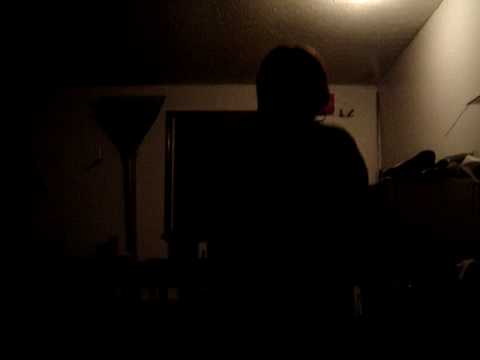
You are a GUI agent. You are given a task and a screenshot of the screen. Output one action in this format:
    pyautogui.click(x=<x>, y=<y>)
    Task: Click on the wall
    This screenshot has height=360, width=480.
    Given the screenshot: What is the action you would take?
    pyautogui.click(x=364, y=129), pyautogui.click(x=152, y=184), pyautogui.click(x=213, y=97), pyautogui.click(x=109, y=215)